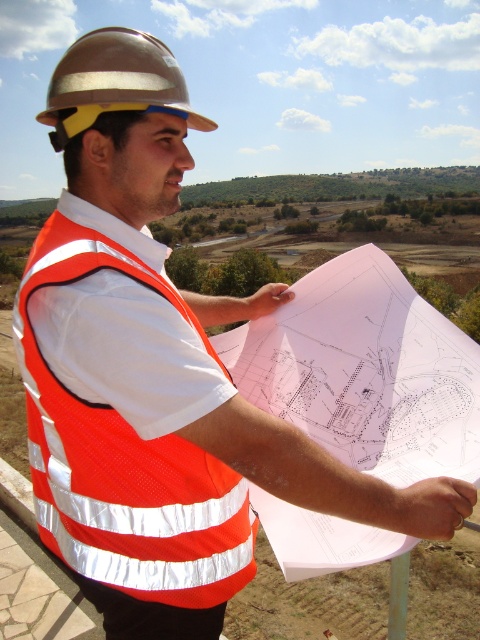
Question: Which of the following is the closest to the observer?

Choices:
 (A) reflective orange safety vest at center
 (B) metallic hard hat at upper left

Answer: (B)

Question: Does reflective orange safety vest at center come in front of metallic hard hat at upper left?

Choices:
 (A) no
 (B) yes

Answer: (A)

Question: Can you confirm if reflective orange safety vest at center is positioned above metallic hard hat at upper left?

Choices:
 (A) yes
 (B) no

Answer: (B)

Question: Can you confirm if reflective orange safety vest at center is positioned to the right of metallic hard hat at upper left?

Choices:
 (A) no
 (B) yes

Answer: (B)

Question: Which object appears farthest from the camera in this image?

Choices:
 (A) metallic hard hat at upper left
 (B) reflective orange safety vest at center

Answer: (B)

Question: Among these objects, which one is farthest from the camera?

Choices:
 (A) metallic hard hat at upper left
 (B) reflective orange safety vest at center

Answer: (B)